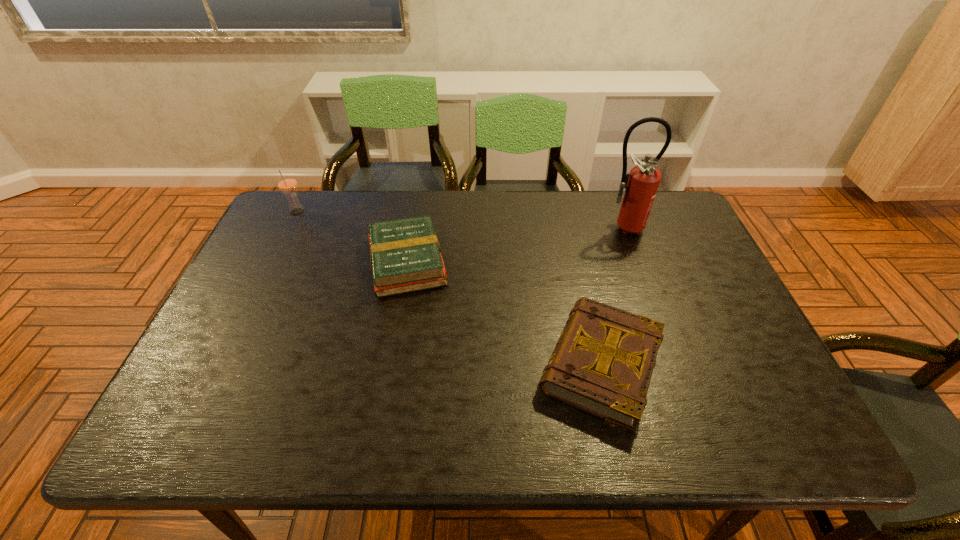
Find the location of a particular element. This screenshot has width=960, height=540. vacant position at the near edge of the desktop is located at coordinates (537, 418).

Image resolution: width=960 pixels, height=540 pixels. In the image, there is a desktop. In order to click on vacant space at the left edge in this screenshot , I will do `click(236, 327)`.

You are a GUI agent. You are given a task and a screenshot of the screen. Output one action in this format:
    pyautogui.click(x=<x>, y=<y>)
    Task: Click on the vacant space at the right edge of the desktop
    The width and height of the screenshot is (960, 540).
    Given the screenshot: What is the action you would take?
    pos(690,245)

This screenshot has width=960, height=540. In order to click on free area in between the straw and the third object from right to left in this screenshot , I will do `click(352, 237)`.

What are the coordinates of `vacant area that lies between the nearer hardback book and the leftmost object` in the screenshot? It's located at (449, 289).

The height and width of the screenshot is (540, 960). What are the coordinates of `vacant region between the farther hardback book and the fire extinguisher` in the screenshot? It's located at (515, 245).

This screenshot has height=540, width=960. What are the coordinates of `vacant area between the third object from right to left and the leftmost object` in the screenshot? It's located at (352, 237).

Locate an element on the screen. This screenshot has width=960, height=540. empty space between the leftmost object and the tallest object is located at coordinates (460, 220).

Image resolution: width=960 pixels, height=540 pixels. I want to click on free space between the nearest object and the tallest object, so click(612, 296).

You are a GUI agent. You are given a task and a screenshot of the screen. Output one action in this format:
    pyautogui.click(x=<x>, y=<y>)
    Task: Click on the empty space between the farther hardback book and the third shortest object
    The width and height of the screenshot is (960, 540).
    Given the screenshot: What is the action you would take?
    pyautogui.click(x=352, y=237)